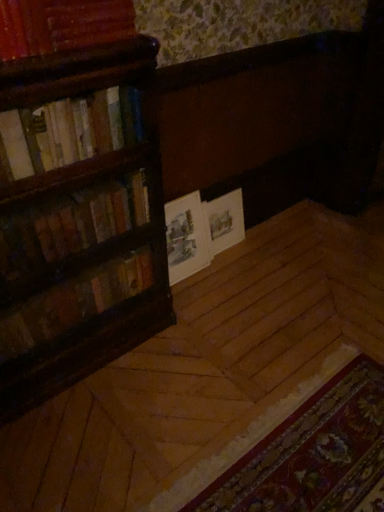
Question: Are wooden book at upper left, which is counted as the fourth book, starting from the bottom, and white paper book at center making contact?

Choices:
 (A) no
 (B) yes

Answer: (A)

Question: Is the position of wooden book at upper left, placed as the 1th book when sorted from top to bottom, more distant than that of white paper book at center?

Choices:
 (A) yes
 (B) no

Answer: (B)

Question: Considering the relative sizes of wooden book at upper left, which is counted as the fourth book, starting from the bottom, and white paper book at center in the image provided, is wooden book at upper left, which is counted as the fourth book, starting from the bottom, taller than white paper book at center?

Choices:
 (A) yes
 (B) no

Answer: (B)

Question: From a real-world perspective, is wooden book at upper left, which is counted as the fourth book, starting from the bottom, beneath white paper book at center?

Choices:
 (A) no
 (B) yes

Answer: (A)

Question: Is wooden book at upper left, which is counted as the fourth book, starting from the bottom, facing away from white paper book at center?

Choices:
 (A) yes
 (B) no

Answer: (B)

Question: Is wooden book at upper left, placed as the 1th book when sorted from top to bottom, shorter than white paper book at center?

Choices:
 (A) no
 (B) yes

Answer: (B)

Question: Is hardcover books at left, arranged as the 2th book when viewed from the top, touching wooden bookshelf at left, placed as the 4th book when sorted from top to bottom?

Choices:
 (A) yes
 (B) no

Answer: (B)

Question: Is hardcover books at left, arranged as the 2th book when viewed from the top, far from wooden bookshelf at left, placed as the 4th book when sorted from top to bottom?

Choices:
 (A) yes
 (B) no

Answer: (B)

Question: Is hardcover books at left, arranged as the 2th book when viewed from the top, at the left side of wooden bookshelf at left, placed as the 4th book when sorted from top to bottom?

Choices:
 (A) no
 (B) yes

Answer: (A)

Question: Is hardcover books at left, arranged as the 2th book when viewed from the top, bigger than wooden bookshelf at left, placed as the first book when sorted from bottom to top?

Choices:
 (A) yes
 (B) no

Answer: (B)

Question: Is hardcover books at left, arranged as the 2th book when viewed from the top, outside wooden bookshelf at left, placed as the first book when sorted from bottom to top?

Choices:
 (A) yes
 (B) no

Answer: (A)

Question: Does hardcover books at left, arranged as the third book when ordered from the bottom, have a smaller size compared to wooden bookshelf at left, placed as the 4th book when sorted from top to bottom?

Choices:
 (A) yes
 (B) no

Answer: (A)

Question: Considering the relative positions of hardcover books at left, arranged as the third book when ordered from the bottom, and wooden book at upper left, placed as the 1th book when sorted from top to bottom, in the image provided, is hardcover books at left, arranged as the third book when ordered from the bottom, to the left of wooden book at upper left, placed as the 1th book when sorted from top to bottom, from the viewer's perspective?

Choices:
 (A) no
 (B) yes

Answer: (B)